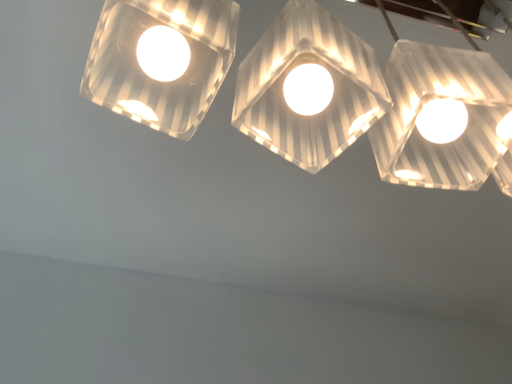
What do you see at coordinates (378, 101) in the screenshot? I see `clear glass lampshade at upper center` at bounding box center [378, 101].

Where is `clear glass lampshade at upper center`? clear glass lampshade at upper center is located at coordinates (378, 101).

Identify the location of clear glass lampshade at upper center. This screenshot has width=512, height=384. (378, 101).